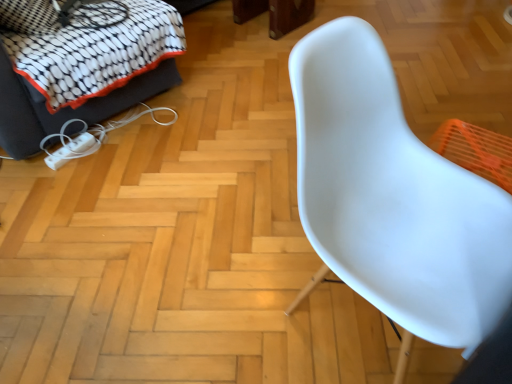
Question: Which is correct: white fabric sofa at upper left is inside white plastic chair at right, or outside of it?

Choices:
 (A) outside
 (B) inside

Answer: (A)

Question: Is white fabric sofa at upper left in front of or behind white plastic chair at right in the image?

Choices:
 (A) front
 (B) behind

Answer: (B)

Question: From a real-world perspective, is white fabric sofa at upper left above or below white plastic chair at right?

Choices:
 (A) below
 (B) above

Answer: (A)

Question: Looking at the image, does white plastic chair at right seem bigger or smaller compared to white fabric sofa at upper left?

Choices:
 (A) big
 (B) small

Answer: (B)

Question: From the image's perspective, is white plastic chair at right located above or below white fabric sofa at upper left?

Choices:
 (A) below
 (B) above

Answer: (A)

Question: From a real-world perspective, is white plastic chair at right physically located above or below white fabric sofa at upper left?

Choices:
 (A) below
 (B) above

Answer: (B)

Question: Considering the positions of white plastic chair at right and white fabric sofa at upper left in the image, is white plastic chair at right taller or shorter than white fabric sofa at upper left?

Choices:
 (A) short
 (B) tall

Answer: (B)